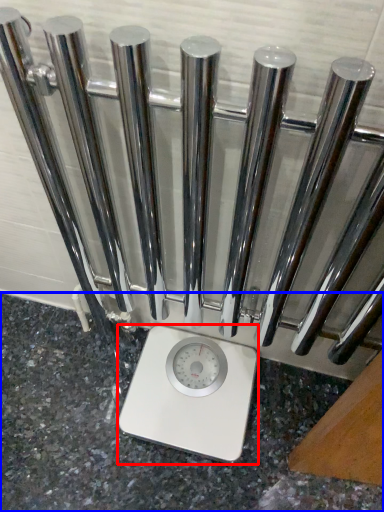
Question: Which point is further to the camera, scale (highlighted by a red box) or granite (highlighted by a blue box)?

Choices:
 (A) scale
 (B) granite

Answer: (A)